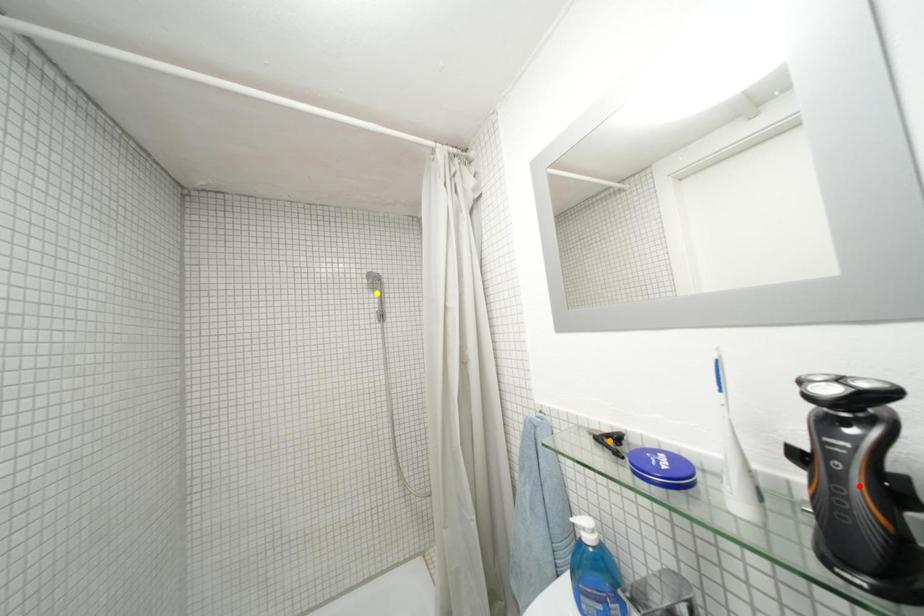
Order these from nearest to farthest:
yellow point
orange point
red point

red point < orange point < yellow point